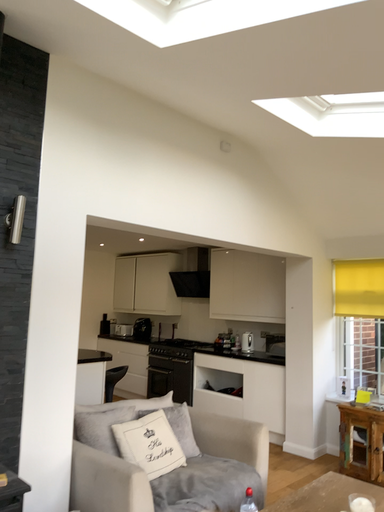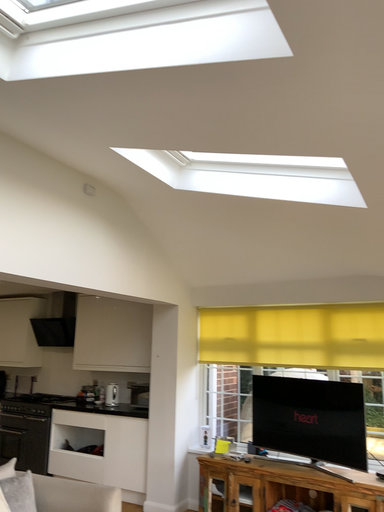
Question: How did the camera likely rotate when shooting the video?

Choices:
 (A) rotated left
 (B) rotated right

Answer: (B)